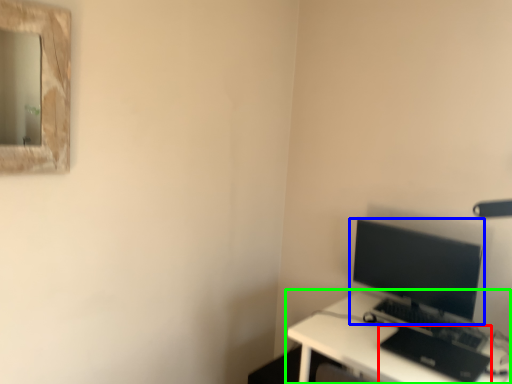
Question: Which is nearer to the laptop (highlighted by a red box)? computer monitor (highlighted by a blue box) or desk (highlighted by a green box).

Choices:
 (A) computer monitor
 (B) desk

Answer: (B)